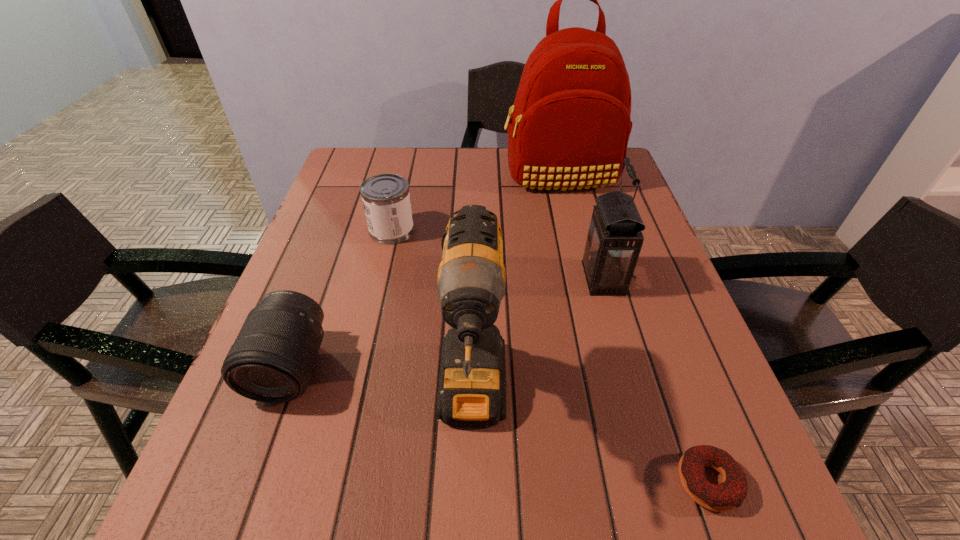
At what (x,y) coordinates should I click in order to perform the action: click on telephoto lens that is at the left edge. Please return your answer as a coordinate pair (x, y). Looking at the image, I should click on (272, 360).

Locate an element on the screen. This screenshot has width=960, height=540. can at the left edge is located at coordinates (386, 199).

The height and width of the screenshot is (540, 960). In order to click on backpack located in the right edge section of the desktop in this screenshot , I will do `click(570, 126)`.

You are a GUI agent. You are given a task and a screenshot of the screen. Output one action in this format:
    pyautogui.click(x=<x>, y=<y>)
    Task: Click on the lantern present at the right edge
    
    Given the screenshot: What is the action you would take?
    pyautogui.click(x=614, y=240)

At what (x,y) coordinates should I click in order to perform the action: click on doughnut positioned at the right edge. Please return your answer as a coordinate pair (x, y). This screenshot has width=960, height=540. Looking at the image, I should click on (731, 492).

The width and height of the screenshot is (960, 540). I want to click on object at the far right corner, so click(570, 126).

I want to click on object that is at the near right corner, so click(731, 492).

You are a GUI agent. You are given a task and a screenshot of the screen. Output one action in this format:
    pyautogui.click(x=<x>, y=<y>)
    Task: Click on the free spot at the far edge of the desktop
    
    Given the screenshot: What is the action you would take?
    pyautogui.click(x=400, y=175)

In the image, there is a desktop. At what (x,y) coordinates should I click in order to perform the action: click on vacant space at the near edge. Please return your answer as a coordinate pair (x, y). The height and width of the screenshot is (540, 960). Looking at the image, I should click on (537, 536).

This screenshot has height=540, width=960. I want to click on free location at the left edge of the desktop, so click(x=208, y=460).